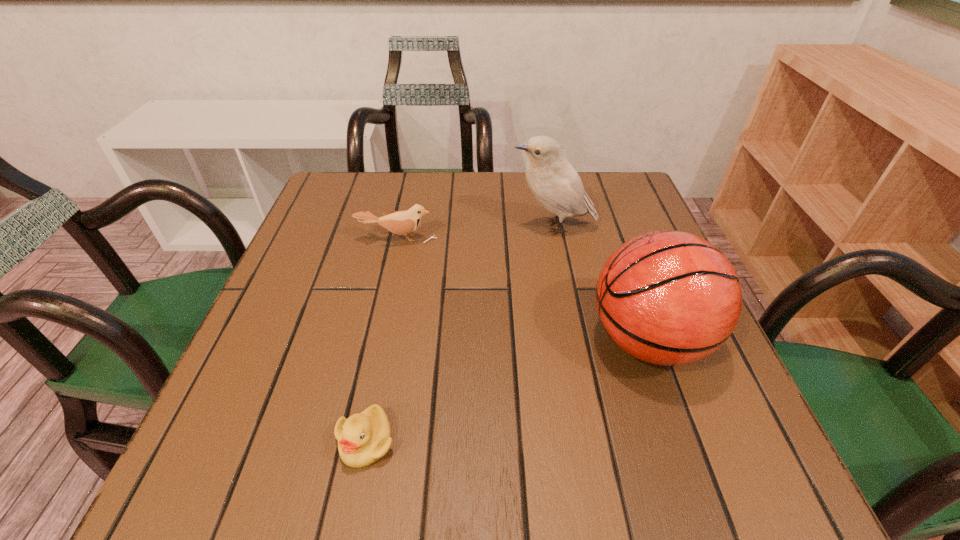
The image size is (960, 540). I want to click on free spot that satisfies the following two spatial constraints: 1. at the beak of the taller bird; 2. on the front-facing side of the nearest object, so click(x=596, y=441).